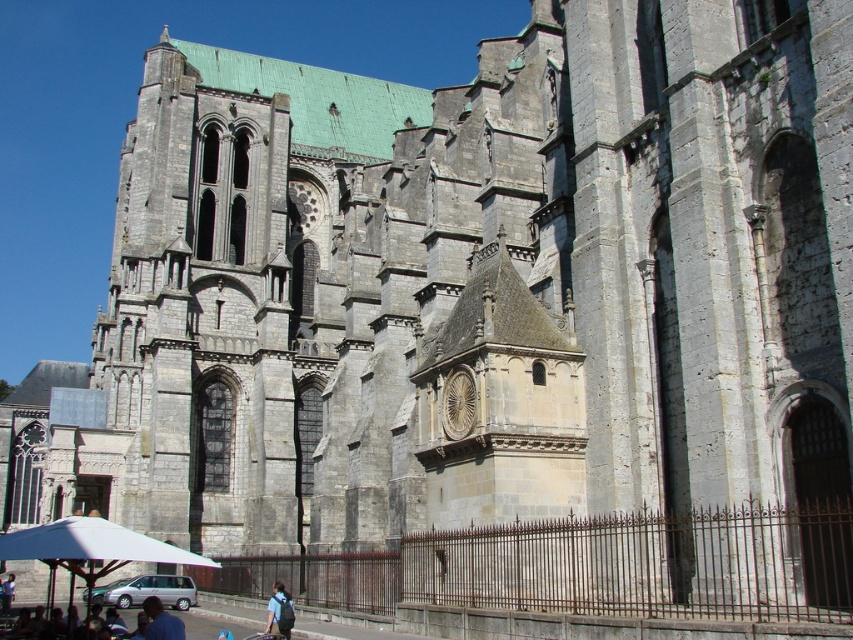
From the picture: Does dark blue shirt at lower center have a larger size compared to blue fabric backpack at lower center?

Yes.

Does dark blue shirt at lower center have a smaller size compared to blue fabric backpack at lower center?

Incorrect, dark blue shirt at lower center is not smaller in size than blue fabric backpack at lower center.

Does point (161, 637) lie behind point (292, 608)?

No, (161, 637) is closer to viewer.

At what (x,y) coordinates should I click in order to perform the action: click on dark blue shirt at lower center. Please return your answer as a coordinate pair (x, y). Looking at the image, I should click on (161, 621).